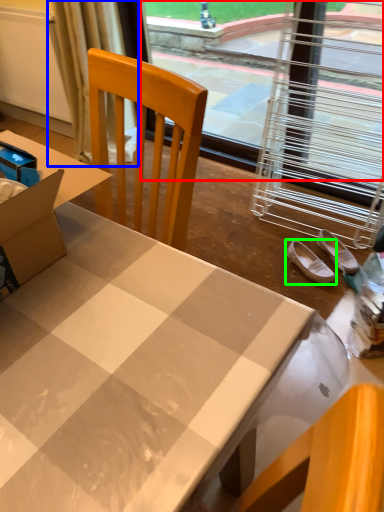
Question: Which object is the closest to the window screen (highlighted by a red box)? Choose among these: curtain (highlighted by a blue box) or footwear (highlighted by a green box).

Choices:
 (A) curtain
 (B) footwear

Answer: (A)